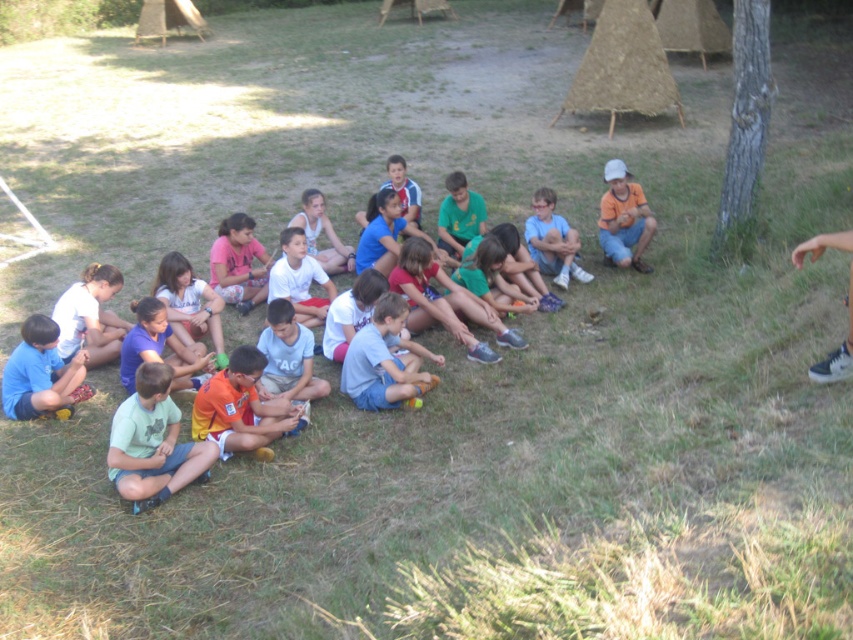
You are a photographer trying to capture a closeup of the blue fabric shorts at lower left and the white fabric shoe at lower right. Since you want to focus on both objects equally, which object should you zoom in on more to ensure they appear the same size in the photo?

The blue fabric shorts at lower left is larger in size than the white fabric shoe at lower right, so you should zoom in more on the white fabric shoe at lower right to make them appear the same size.